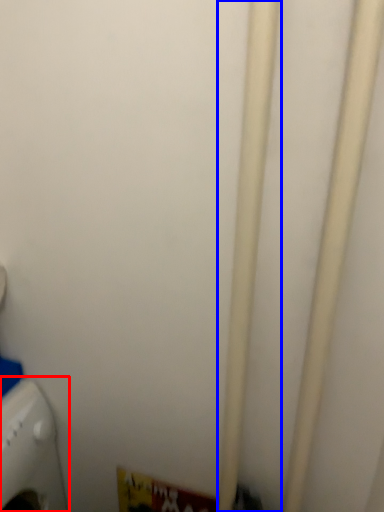
Question: Which object is further to the camera taking this photo, home appliance (highlighted by a red box) or pipe (highlighted by a blue box)?

Choices:
 (A) home appliance
 (B) pipe

Answer: (A)